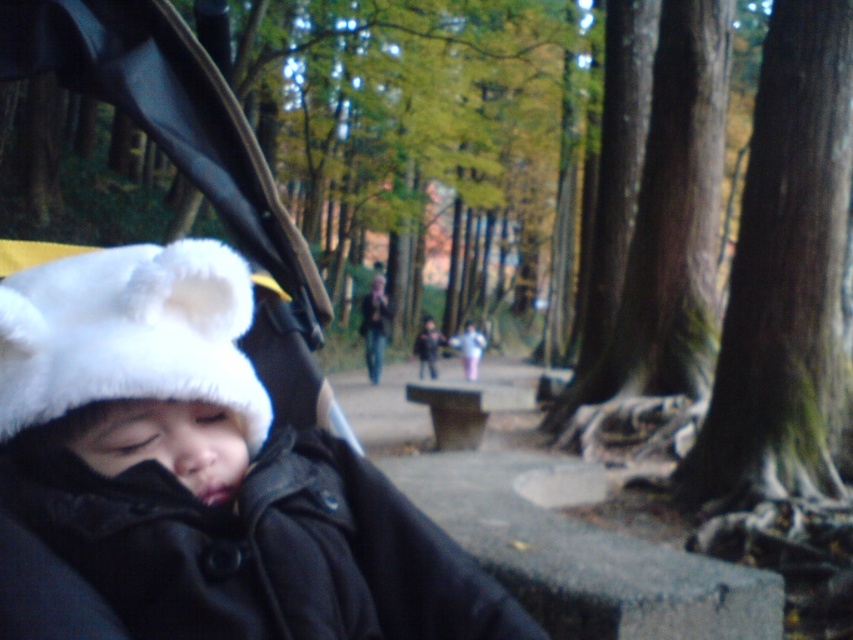
Question: Is black fabric baby carriage at center bigger than white furry hat at left?

Choices:
 (A) yes
 (B) no

Answer: (A)

Question: Does black fabric baby carriage at center have a smaller size compared to white furry hat at left?

Choices:
 (A) yes
 (B) no

Answer: (B)

Question: Which point is closer to the camera?

Choices:
 (A) (x=32, y=346)
 (B) (x=531, y=636)
 (C) (x=419, y=525)

Answer: (A)

Question: Which point is farther to the camera?

Choices:
 (A) (151, 336)
 (B) (192, 332)

Answer: (B)

Question: Estimate the real-world distances between objects in this image. Which object is closer to the black fabric baby carriage at center?

Choices:
 (A) black matte jacket at left
 (B) white furry hat at left

Answer: (B)

Question: Is black matte jacket at left smaller than white furry hat at left?

Choices:
 (A) no
 (B) yes

Answer: (A)